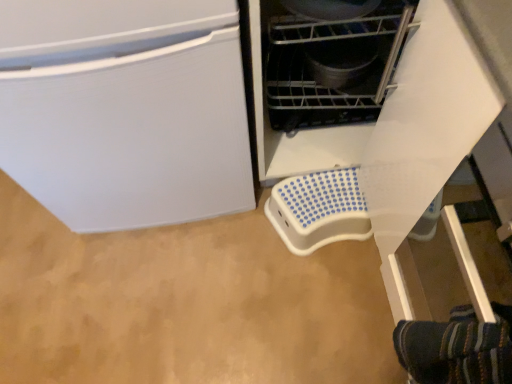
You are a GUI agent. You are given a task and a screenshot of the screen. Output one action in this format:
    pyautogui.click(x=<x>, y=<y>)
    Task: Click on the white plastic step stool at lower center, placed as the first appliance when sorted from bottom to top
    
    Given the screenshot: What is the action you would take?
    pyautogui.click(x=318, y=210)

Describe the element at coordinates (318, 210) in the screenshot. The width and height of the screenshot is (512, 384). I see `white plastic step stool at lower center, the second appliance from the front` at that location.

How much space does white plastic step stool at lower center, acting as the second appliance starting from the top, occupy vertically?

5.29 inches.

Based on the photo, measure the distance between point (298, 227) and camera.

The depth of point (298, 227) is 1.25 meters.

At what (x,y) coordinates should I click in order to perform the action: click on metallic gray pot at center, placed as the second appliance when sorted from back to front. Please return your answer as a coordinate pair (x, y). Looking at the image, I should click on [x=332, y=66].

This screenshot has height=384, width=512. Describe the element at coordinates (332, 66) in the screenshot. I see `metallic gray pot at center, placed as the second appliance when sorted from back to front` at that location.

Locate an element on the screen. The image size is (512, 384). white plastic step stool at lower center, the second appliance from the front is located at coordinates (318, 210).

Which is more to the left, white plastic step stool at lower center, acting as the second appliance starting from the top, or metallic gray pot at center, the second appliance ordered from the bottom?

From the viewer's perspective, metallic gray pot at center, the second appliance ordered from the bottom, appears more on the left side.

Consider the image. Which object is closer to the camera, white plastic step stool at lower center, the 1th appliance when ordered from back to front, or metallic gray pot at center, the second appliance ordered from the bottom?

metallic gray pot at center, the second appliance ordered from the bottom.

Is point (369, 225) less distant than point (281, 46)?

No, it is behind (281, 46).

From the image's perspective, would you say white plastic step stool at lower center, acting as the second appliance starting from the top, is positioned over metallic gray pot at center, the second appliance ordered from the bottom?

No, from the image's perspective, white plastic step stool at lower center, acting as the second appliance starting from the top, is not on top of metallic gray pot at center, the second appliance ordered from the bottom.

From a real-world perspective, is white plastic step stool at lower center, acting as the second appliance starting from the top, above or below metallic gray pot at center, placed as the second appliance when sorted from back to front?

Clearly, from a real-world perspective, white plastic step stool at lower center, acting as the second appliance starting from the top, is below metallic gray pot at center, placed as the second appliance when sorted from back to front.

Which of these two, white plastic step stool at lower center, placed as the first appliance when sorted from bottom to top, or metallic gray pot at center, placed as the second appliance when sorted from back to front, is wider?

white plastic step stool at lower center, placed as the first appliance when sorted from bottom to top, is wider.

Which of these two, white plastic step stool at lower center, the 1th appliance when ordered from back to front, or metallic gray pot at center, placed as the second appliance when sorted from back to front, stands shorter?

Standing shorter between the two is white plastic step stool at lower center, the 1th appliance when ordered from back to front.

Considering the relative sizes of white plastic step stool at lower center, the second appliance from the front, and metallic gray pot at center, placed as the second appliance when sorted from back to front, in the image provided, is white plastic step stool at lower center, the second appliance from the front, bigger than metallic gray pot at center, placed as the second appliance when sorted from back to front,?

Incorrect, white plastic step stool at lower center, the second appliance from the front, is not larger than metallic gray pot at center, placed as the second appliance when sorted from back to front.

Based on the photo, is metallic gray pot at center, marked as the 1th appliance in a top-to-bottom arrangement, completely or partially inside white plastic step stool at lower center, the second appliance from the front?

No, metallic gray pot at center, marked as the 1th appliance in a top-to-bottom arrangement, is not surrounded by white plastic step stool at lower center, the second appliance from the front.

Are white plastic step stool at lower center, the second appliance from the front, and metallic gray pot at center, marked as the 1th appliance in a top-to-bottom arrangement, far apart?

No, white plastic step stool at lower center, the second appliance from the front, is not far from metallic gray pot at center, marked as the 1th appliance in a top-to-bottom arrangement.

From the picture: Is white plastic step stool at lower center, the second appliance from the front, looking in the opposite direction of metallic gray pot at center, marked as the 1th appliance in a top-to-bottom arrangement?

white plastic step stool at lower center, the second appliance from the front, is not turned away from metallic gray pot at center, marked as the 1th appliance in a top-to-bottom arrangement.

Find the location of a particular element. The width and height of the screenshot is (512, 384). appliance on the left of the white plastic step stool at lower center, placed as the first appliance when sorted from bottom to top is located at coordinates (332, 66).

Is metallic gray pot at center, the 1th appliance when ordered from front to back, at the right side of white plastic step stool at lower center, the 1th appliance when ordered from back to front?

In fact, metallic gray pot at center, the 1th appliance when ordered from front to back, is to the left of white plastic step stool at lower center, the 1th appliance when ordered from back to front.

Is metallic gray pot at center, marked as the 1th appliance in a top-to-bottom arrangement, in front of or behind white plastic step stool at lower center, placed as the first appliance when sorted from bottom to top, in the image?

Visually, metallic gray pot at center, marked as the 1th appliance in a top-to-bottom arrangement, is located in front of white plastic step stool at lower center, placed as the first appliance when sorted from bottom to top.

Does point (364, 27) lie in front of point (348, 215)?

Yes.

From the image's perspective, is metallic gray pot at center, the 1th appliance when ordered from front to back, located above or below white plastic step stool at lower center, the 1th appliance when ordered from back to front?

metallic gray pot at center, the 1th appliance when ordered from front to back, is situated higher than white plastic step stool at lower center, the 1th appliance when ordered from back to front, in the image.

From a real-world perspective, who is located lower, metallic gray pot at center, placed as the second appliance when sorted from back to front, or white plastic step stool at lower center, acting as the second appliance starting from the top?

white plastic step stool at lower center, acting as the second appliance starting from the top.

Considering the sizes of objects metallic gray pot at center, the second appliance ordered from the bottom, and white plastic step stool at lower center, the second appliance from the front, in the image provided, who is wider, metallic gray pot at center, the second appliance ordered from the bottom, or white plastic step stool at lower center, the second appliance from the front,?

With larger width is white plastic step stool at lower center, the second appliance from the front.

Between metallic gray pot at center, placed as the second appliance when sorted from back to front, and white plastic step stool at lower center, the second appliance from the front, which one has more height?

metallic gray pot at center, placed as the second appliance when sorted from back to front, is taller.

In terms of size, does metallic gray pot at center, marked as the 1th appliance in a top-to-bottom arrangement, appear bigger or smaller than white plastic step stool at lower center, acting as the second appliance starting from the top?

Clearly, metallic gray pot at center, marked as the 1th appliance in a top-to-bottom arrangement, is larger in size than white plastic step stool at lower center, acting as the second appliance starting from the top.

Is metallic gray pot at center, placed as the second appliance when sorted from back to front, not inside white plastic step stool at lower center, placed as the first appliance when sorted from bottom to top?

That's correct, metallic gray pot at center, placed as the second appliance when sorted from back to front, is outside of white plastic step stool at lower center, placed as the first appliance when sorted from bottom to top.

Would you consider metallic gray pot at center, the second appliance ordered from the bottom, to be distant from white plastic step stool at lower center, the second appliance from the front?

No.

Could you tell me if metallic gray pot at center, the 1th appliance when ordered from front to back, is facing white plastic step stool at lower center, acting as the second appliance starting from the top?

No, metallic gray pot at center, the 1th appliance when ordered from front to back, is not oriented towards white plastic step stool at lower center, acting as the second appliance starting from the top.

Can you tell me how much metallic gray pot at center, placed as the second appliance when sorted from back to front, and white plastic step stool at lower center, acting as the second appliance starting from the top, differ in facing direction?

89 degrees separate the facing orientations of metallic gray pot at center, placed as the second appliance when sorted from back to front, and white plastic step stool at lower center, acting as the second appliance starting from the top.

Find the location of a particular element. appliance directly beneath the metallic gray pot at center, marked as the 1th appliance in a top-to-bottom arrangement (from a real-world perspective) is located at coordinates (318, 210).

I want to click on appliance above the white plastic step stool at lower center, placed as the first appliance when sorted from bottom to top (from the image's perspective), so click(x=332, y=66).

You are a GUI agent. You are given a task and a screenshot of the screen. Output one action in this format:
    pyautogui.click(x=<x>, y=<y>)
    Task: Click on the appliance in front of the white plastic step stool at lower center, the 1th appliance when ordered from back to front
    The image size is (512, 384).
    Given the screenshot: What is the action you would take?
    pyautogui.click(x=332, y=66)